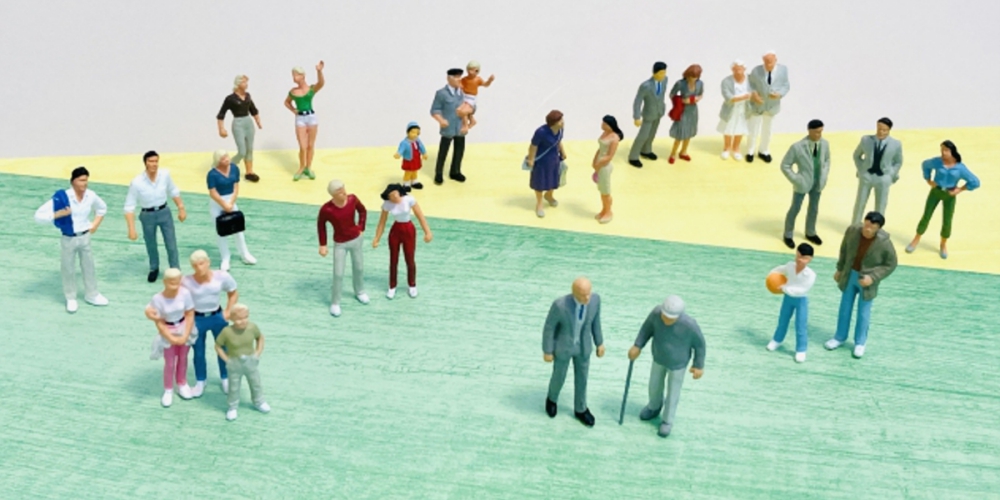
Locate an element on the screen. The height and width of the screenshot is (500, 1000). figurines of children is located at coordinates (240, 343), (407, 149), (465, 90), (798, 287).